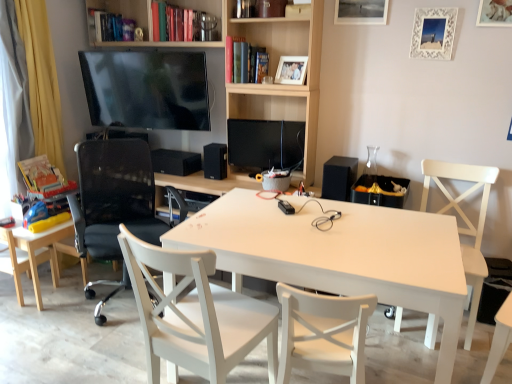
Question: From a real-world perspective, does black matte speaker at right, positioned as the 3th speaker in back-to-front order, stand above wooden photo frame at upper center, marked as the first picture frame in a left-to-right arrangement?

Choices:
 (A) yes
 (B) no

Answer: (B)

Question: Is black matte speaker at right, positioned as the 1th speaker in front-to-back order, surrounding wooden photo frame at upper center, the 4th picture frame viewed from the right?

Choices:
 (A) yes
 (B) no

Answer: (B)

Question: Can you confirm if black matte speaker at right, the 3th speaker viewed from the left, is smaller than wooden photo frame at upper center, the 4th picture frame viewed from the right?

Choices:
 (A) no
 (B) yes

Answer: (A)

Question: Considering the relative sizes of black matte speaker at right, the 3th speaker viewed from the left, and wooden photo frame at upper center, marked as the first picture frame in a left-to-right arrangement, in the image provided, is black matte speaker at right, the 3th speaker viewed from the left, wider than wooden photo frame at upper center, marked as the first picture frame in a left-to-right arrangement,?

Choices:
 (A) yes
 (B) no

Answer: (A)

Question: Is black matte speaker at right, the first speaker when ordered from right to left, behind wooden photo frame at upper center, marked as the first picture frame in a left-to-right arrangement?

Choices:
 (A) yes
 (B) no

Answer: (B)

Question: Is black matte speaker at right, the 3th speaker viewed from the left, not inside wooden photo frame at upper center, marked as the first picture frame in a left-to-right arrangement?

Choices:
 (A) yes
 (B) no

Answer: (A)

Question: Considering the relative sizes of black matte speaker at center, marked as the 2th speaker in a front-to-back arrangement, and wooden photo frame at upper center, the 4th picture frame viewed from the right, in the image provided, is black matte speaker at center, marked as the 2th speaker in a front-to-back arrangement, shorter than wooden photo frame at upper center, the 4th picture frame viewed from the right,?

Choices:
 (A) no
 (B) yes

Answer: (A)

Question: Is black matte speaker at center, which is the 2th speaker in back-to-front order, at the left side of wooden photo frame at upper center, the 4th picture frame viewed from the right?

Choices:
 (A) no
 (B) yes

Answer: (B)

Question: Does black matte speaker at center, which is the second speaker in right-to-left order, have a greater height compared to wooden photo frame at upper center, marked as the first picture frame in a left-to-right arrangement?

Choices:
 (A) no
 (B) yes

Answer: (B)

Question: Is wooden photo frame at upper center, marked as the first picture frame in a left-to-right arrangement, surrounded by black matte speaker at center, marked as the 2th speaker in a front-to-back arrangement?

Choices:
 (A) no
 (B) yes

Answer: (A)

Question: Can you confirm if black matte speaker at center, marked as the 2th speaker in a front-to-back arrangement, is bigger than wooden photo frame at upper center, the 4th picture frame viewed from the right?

Choices:
 (A) no
 (B) yes

Answer: (B)

Question: Is black matte speaker at center, the 2th speaker in the left-to-right sequence, behind wooden photo frame at upper center, the 4th picture frame viewed from the right?

Choices:
 (A) yes
 (B) no

Answer: (A)

Question: Is hardcover book at upper left, arranged as the first book when viewed from the top, at the left side of white wood chair at right, which is the 4th chair from left to right?

Choices:
 (A) no
 (B) yes

Answer: (B)